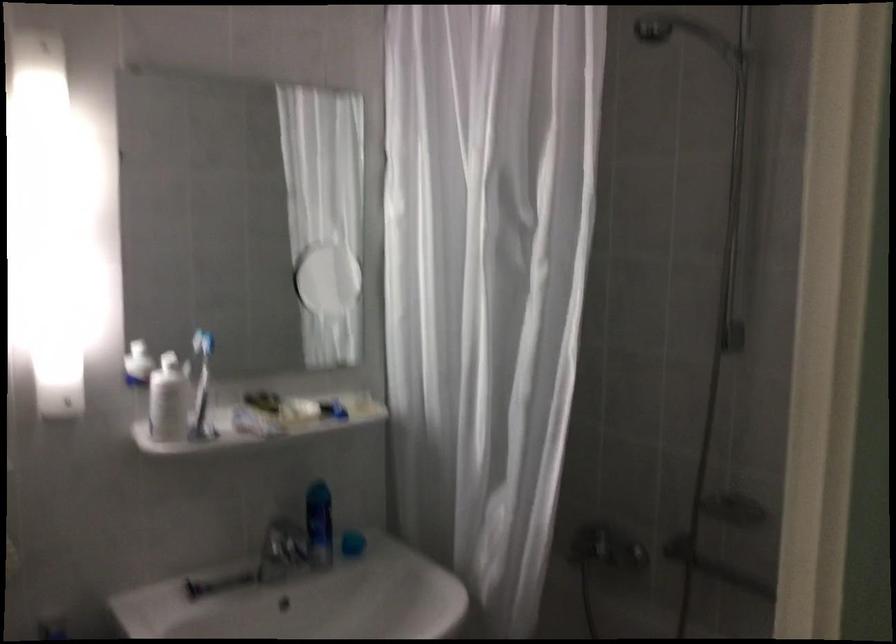
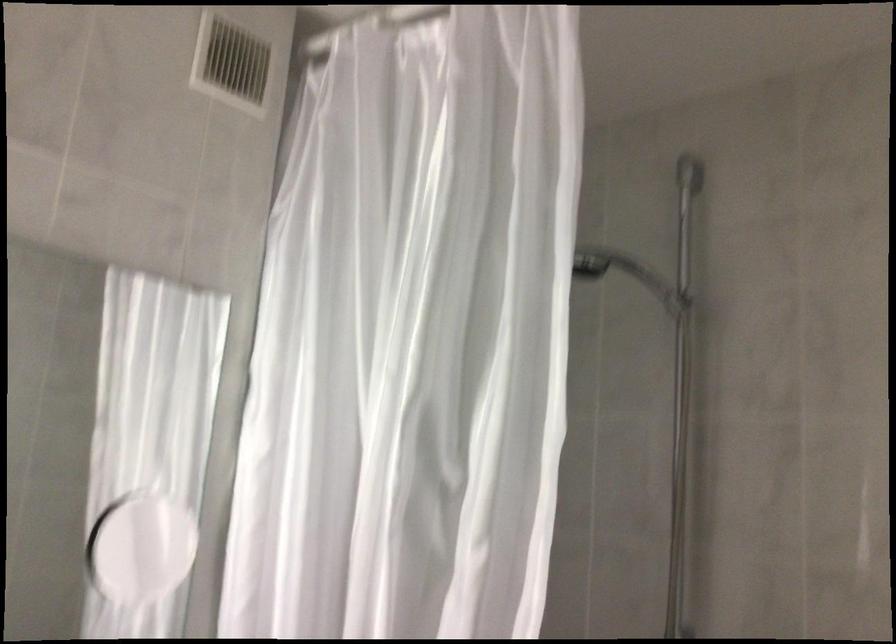
Question: The first image is from the beginning of the video and the second image is from the end. How did the camera likely rotate when shooting the video?

Choices:
 (A) Left
 (B) Right
 (C) Up
 (D) Down

Answer: (C)